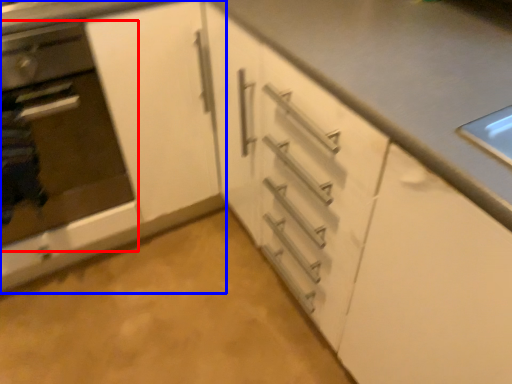
Question: Among these objects, which one is farthest to the camera, oven (highlighted by a red box) or cabinetry (highlighted by a blue box)?

Choices:
 (A) oven
 (B) cabinetry

Answer: (B)